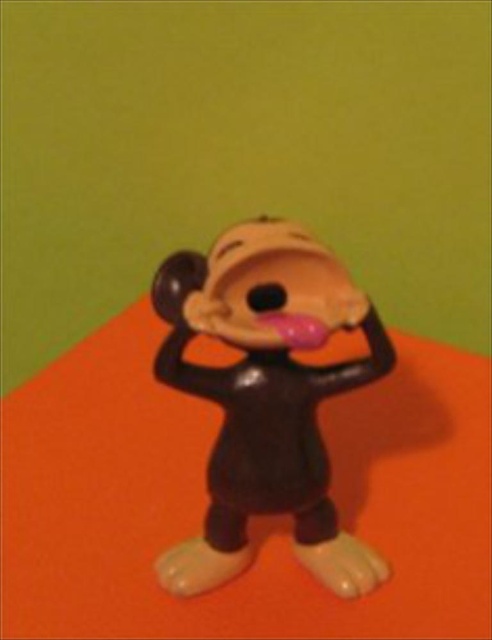
Based on the photo, you are a photographer setting up a shot of the cartoon character figurine. The orange surface it stands on is crucial for the composition. Which object in the scene is located at the coordinates point (251, 520)?

The point (251, 520) corresponds to the orange matte table at center.

You are a photographer trying to capture the figurine from a specific angle. You notice two points on the figurine labeled as point (162,499) and point (326,547). Which point is closer to the camera?

Point (162,499) is further to the camera than point (326,547). Therefore, point (326,547) is closer to the camera.

You are setting up a display for a toy store and need to place the matte plastic monkey at center on the orange matte table at center. Given the size difference between the two, will the monkey fit comfortably on the table without hanging over the edges?

The orange matte table at center has a larger size compared to the matte plastic monkey at center, so the monkey will fit comfortably on the table without hanging over the edges.